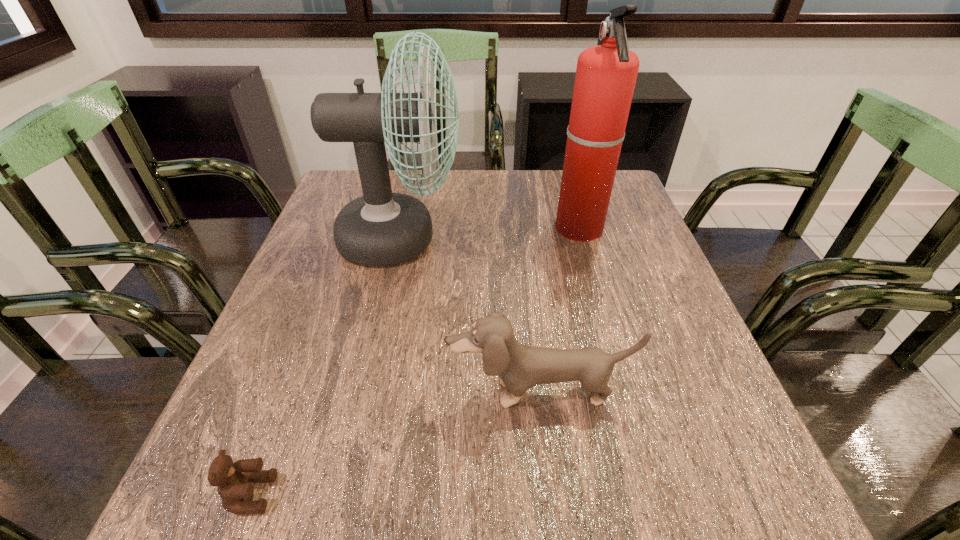
This screenshot has width=960, height=540. I want to click on free space between the fan and the teddy bear, so click(x=325, y=366).

I want to click on vacant region between the fan and the nearest object, so click(x=325, y=366).

Image resolution: width=960 pixels, height=540 pixels. Find the location of `free space between the puppy and the fire extinguisher`. free space between the puppy and the fire extinguisher is located at coordinates (560, 310).

Locate an element on the screen. vacant area that lies between the teddy bear and the puppy is located at coordinates (395, 443).

Identify the location of vacant point located between the second shortest object and the fan. (469, 315).

Where is `empty location between the shortest object and the fire extinguisher`? empty location between the shortest object and the fire extinguisher is located at coordinates (415, 361).

Locate an element on the screen. The image size is (960, 540). unoccupied position between the fan and the fire extinguisher is located at coordinates (490, 234).

This screenshot has width=960, height=540. I want to click on object that is the second closest to the fan, so click(519, 367).

I want to click on object that ranks as the closest to the fire extinguisher, so click(x=381, y=228).

Identify the location of free spot that satisfies the following two spatial constraints: 1. with the nozzle and gauge on the fire extinguisher; 2. at the face of the puppy. (626, 392).